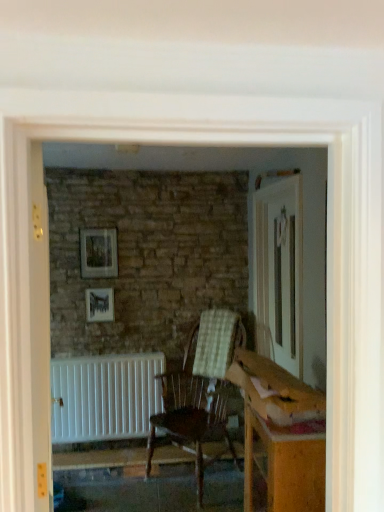
Question: From their relative heights in the image, would you say white matte radiator at lower left is taller or shorter than wooden frame at upper center, the 2th picture frame when ordered from bottom to top?

Choices:
 (A) tall
 (B) short

Answer: (A)

Question: In terms of width, does white matte radiator at lower left look wider or thinner when compared to wooden frame at upper center, which is counted as the 1th picture frame, starting from the top?

Choices:
 (A) thin
 (B) wide

Answer: (B)

Question: Considering the real-world distances, which object is farthest from the matte black picture frame at upper center, which is the first picture frame in bottom-to-top order?

Choices:
 (A) wooden chair with checkered cushion at center
 (B) white matte radiator at left
 (C) wooden frame at upper center, which is counted as the 1th picture frame, starting from the top
 (D) white matte radiator at lower left

Answer: (B)

Question: Which object is positioned closest to the matte black picture frame at upper center, which is the first picture frame in bottom-to-top order?

Choices:
 (A) wooden frame at upper center, which is counted as the 1th picture frame, starting from the top
 (B) wooden chair with checkered cushion at center
 (C) white matte radiator at lower left
 (D) white matte radiator at left

Answer: (A)